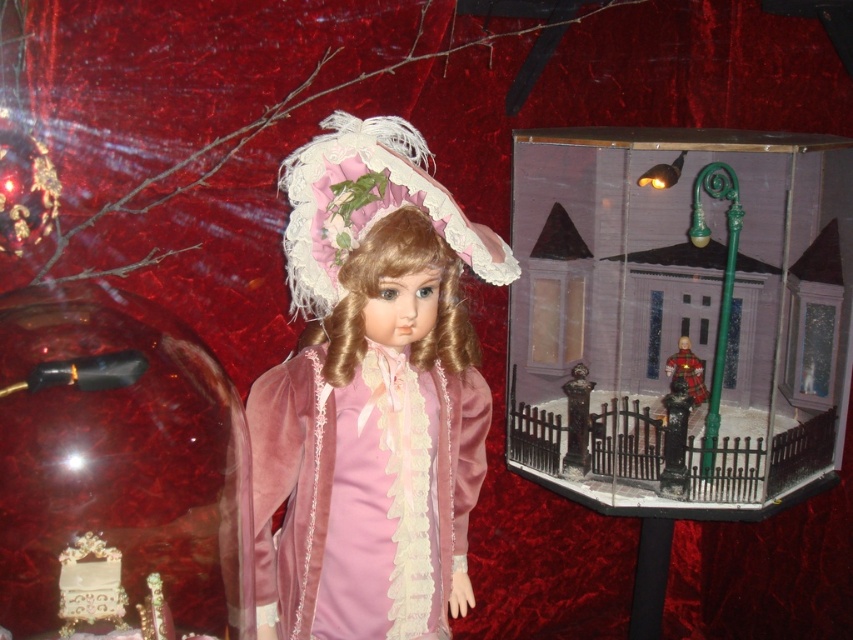
You are a collector who wants to display the transparent plastic diorama at right and the velvet pink doll at center on a shelf. Given that the shelf has limited vertical space, which object should you place first to ensure both can fit?

The transparent plastic diorama at right is shorter than the velvet pink doll at center, so you should place the velvet pink doll at center first to accommodate its height, then the transparent plastic diorama at right can fit below or beside it.

You are a collector who wants to place both the transparent plastic diorama at right and the velvet pink doll at center on a shelf. The shelf has a width of 1 meter. If the diorama is wider than the doll, can both items fit side by side on the shelf without overlapping?

The transparent plastic diorama at right is wider than the velvet pink doll at center. However, since the exact widths are not provided, we cannot determine if both will fit on a 1 meter shelf. More information about their individual widths is needed.

You are an artist planning to paint this scene. You want to ensure that the point at coordinate point (779, 268) and the point at coordinate point (448, 256) are correctly placed in terms of depth. Which point should be painted farther back in the composition?

Point (779, 268) should be painted farther back in the composition because it is behind point (448, 256) according to the spatial description.